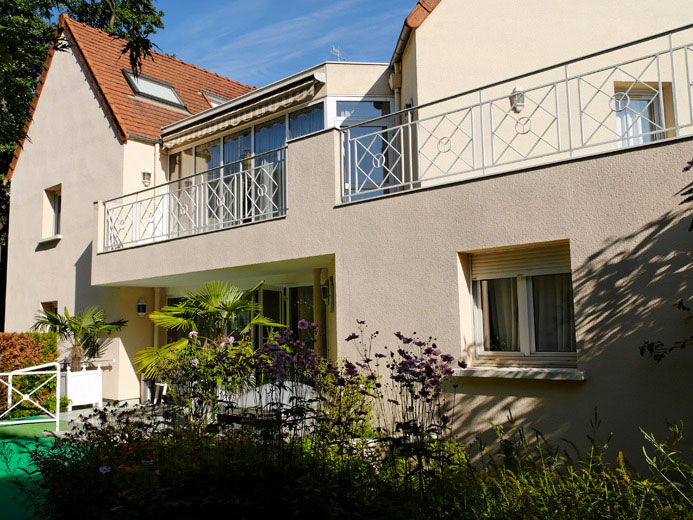
Where is `window`? The image size is (693, 520). window is located at coordinates (504, 343).